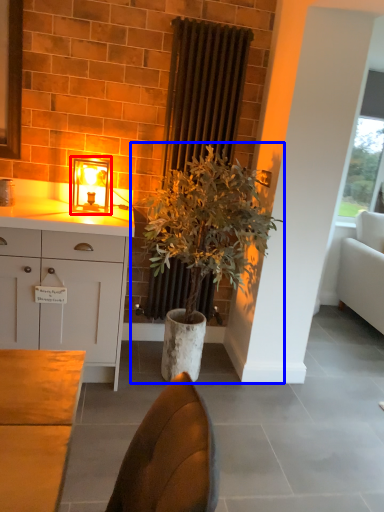
Question: Which object appears closest to the camera in this image, table lamp (highlighted by a red box) or houseplant (highlighted by a blue box)?

Choices:
 (A) table lamp
 (B) houseplant

Answer: (B)